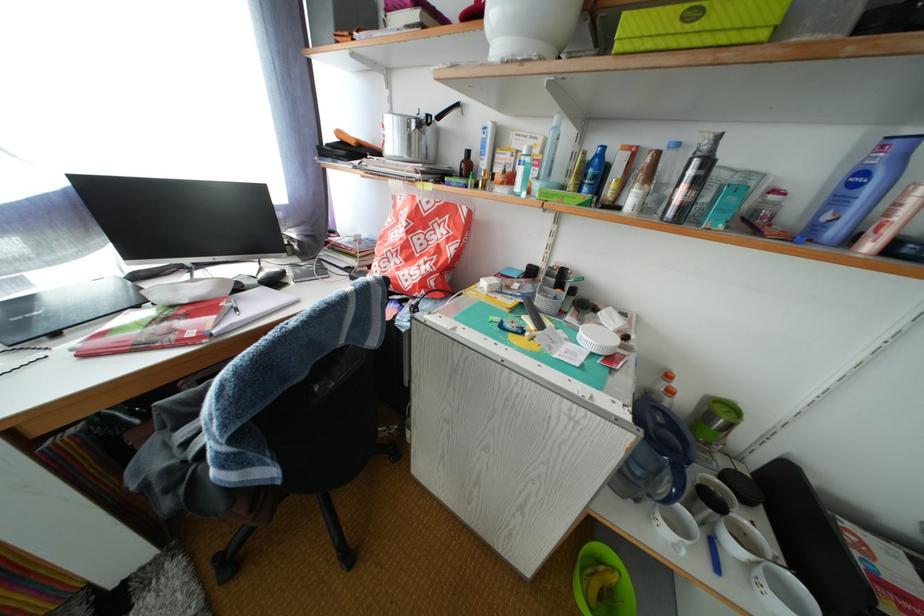
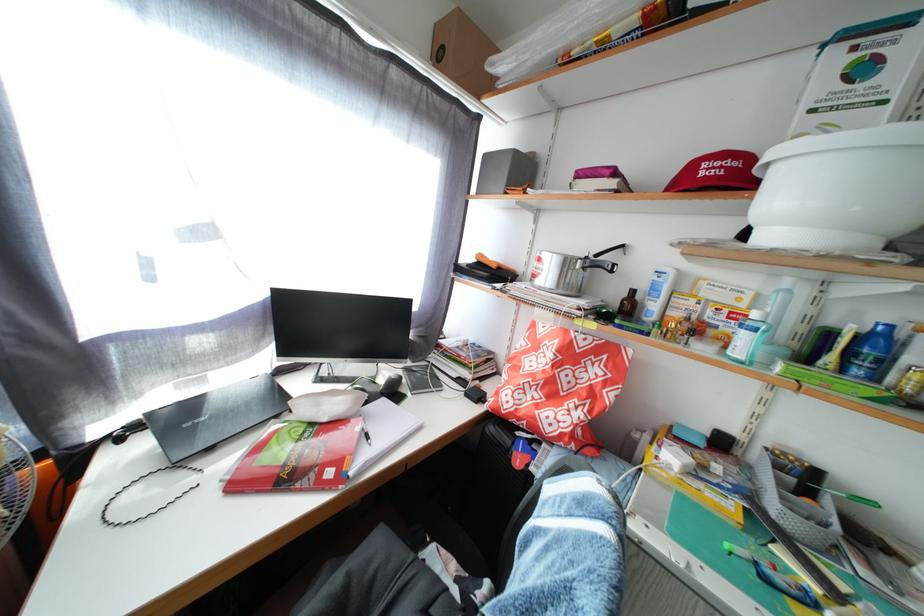
Question: Which direction would the cameraman need to move to produce the second image? Reply with the corresponding letter.

Choices:
 (A) Left
 (B) Right
 (C) Forward
 (D) Backward

Answer: (A)